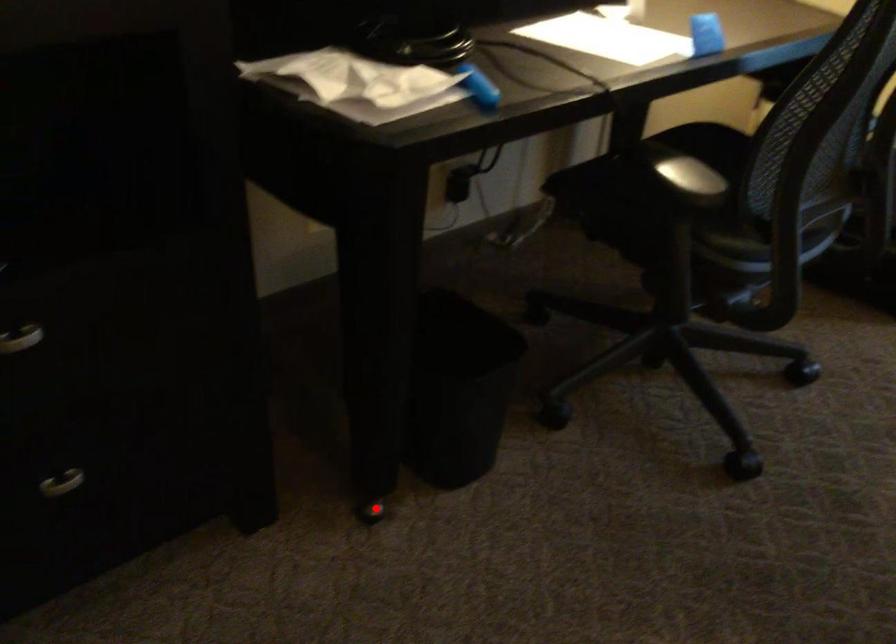
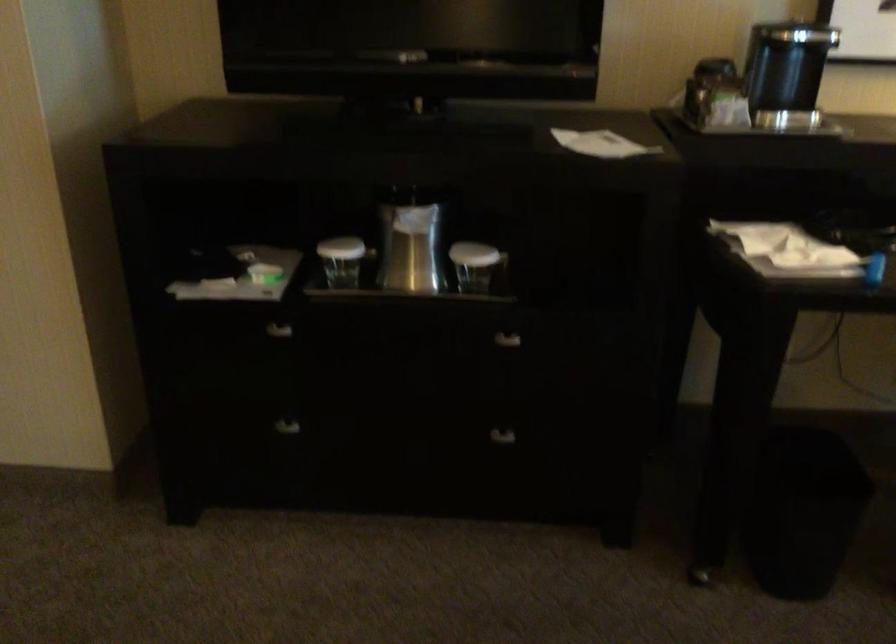
Locate, in the second image, the point that corresponds to the highlighted location in the first image.

(701, 574)